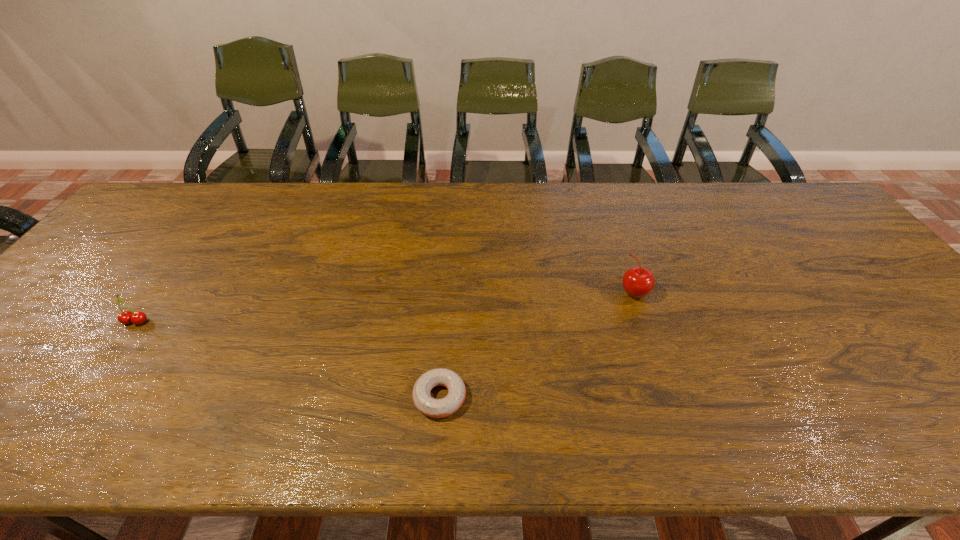
I want to click on free location that satisfies the following two spatial constraints: 1. with the stems of the shorter cherry pointing upwards; 2. on the right side of the shortest object, so click(x=81, y=397).

The image size is (960, 540). I want to click on vacant position in the image that satisfies the following two spatial constraints: 1. with the stems of the leftmost object pointing upwards; 2. on the left side of the nearest object, so click(81, 397).